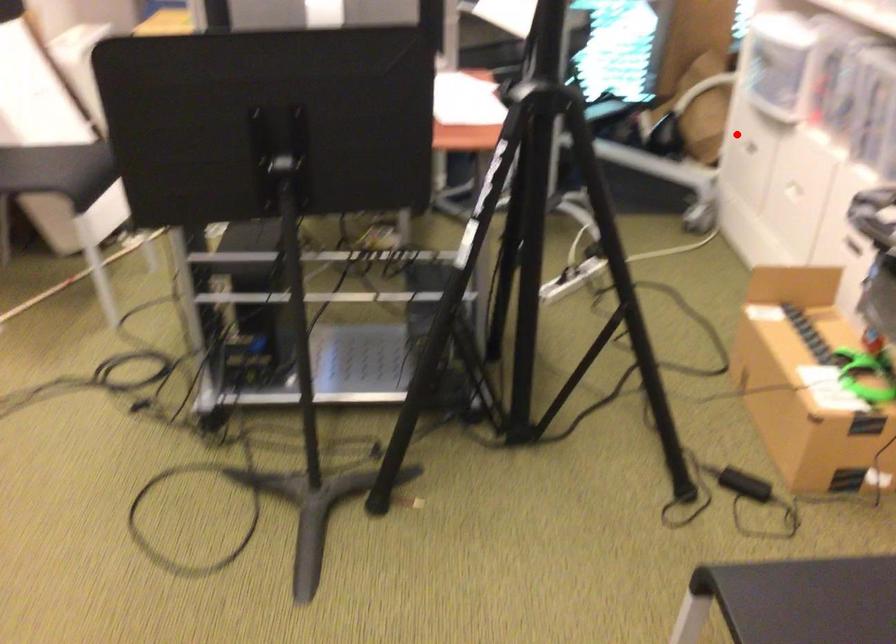
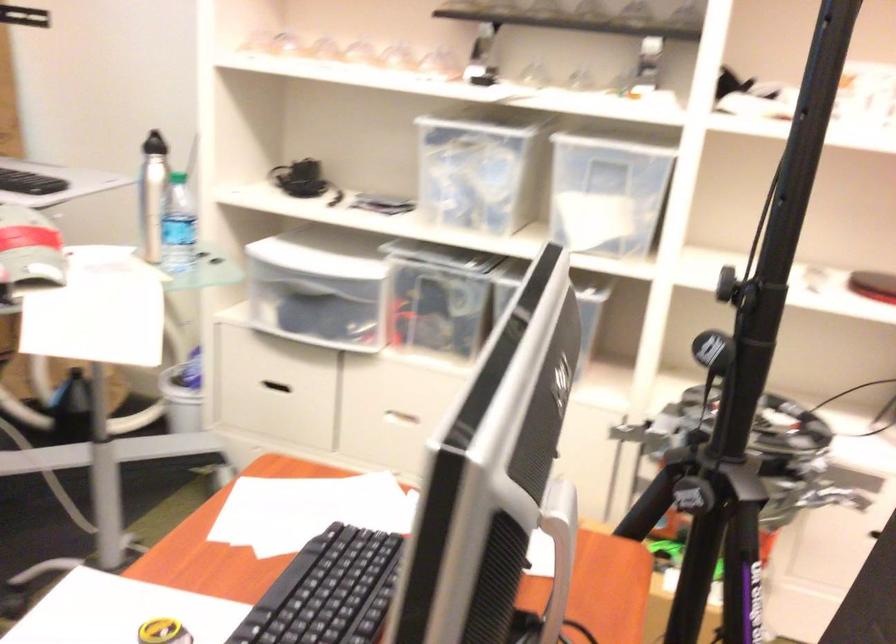
Find the pixel in the second image that matches the highlighted location in the first image.

(271, 389)